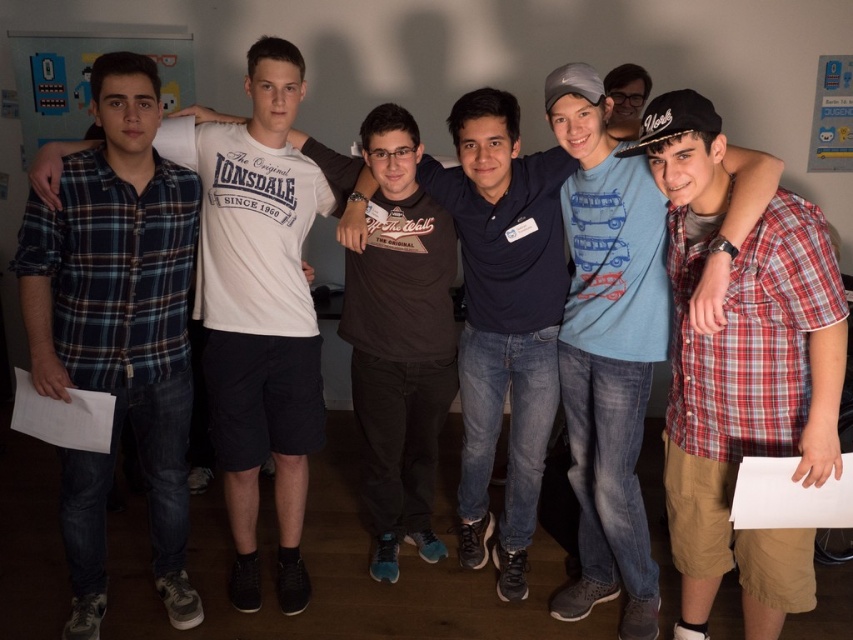
Between plaid flannel shirt at left and brushed metal bulletin board at upper left, which one is positioned lower?

plaid flannel shirt at left

Who is higher up, plaid flannel shirt at left or brushed metal bulletin board at upper left?

brushed metal bulletin board at upper left is higher up.

Is point (177, 440) positioned before point (51, 83)?

Yes, it is in front of point (51, 83).

The image size is (853, 640). Identify the location of plaid flannel shirt at left. (117, 328).

Which is above, plaid cotton shirt at right or brushed metal bulletin board at upper left?

brushed metal bulletin board at upper left

Which is below, plaid cotton shirt at right or brushed metal bulletin board at upper left?

plaid cotton shirt at right

The width and height of the screenshot is (853, 640). What do you see at coordinates (741, 372) in the screenshot?
I see `plaid cotton shirt at right` at bounding box center [741, 372].

At what (x,y) coordinates should I click in order to perform the action: click on plaid cotton shirt at right. Please return your answer as a coordinate pair (x, y). This screenshot has height=640, width=853. Looking at the image, I should click on (741, 372).

The image size is (853, 640). I want to click on plaid cotton shirt at right, so pyautogui.click(x=741, y=372).

Where is `plaid cotton shirt at right`? This screenshot has height=640, width=853. plaid cotton shirt at right is located at coordinates (741, 372).